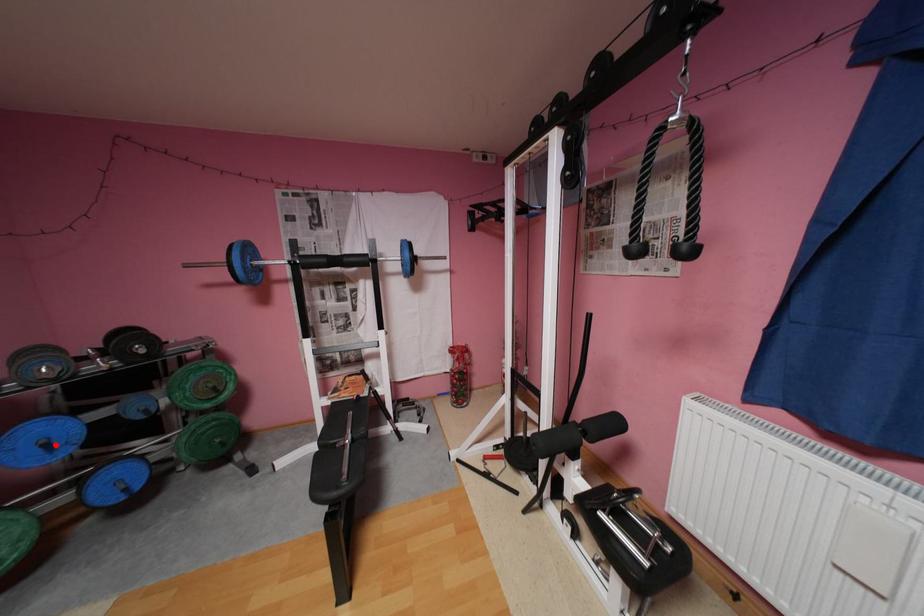
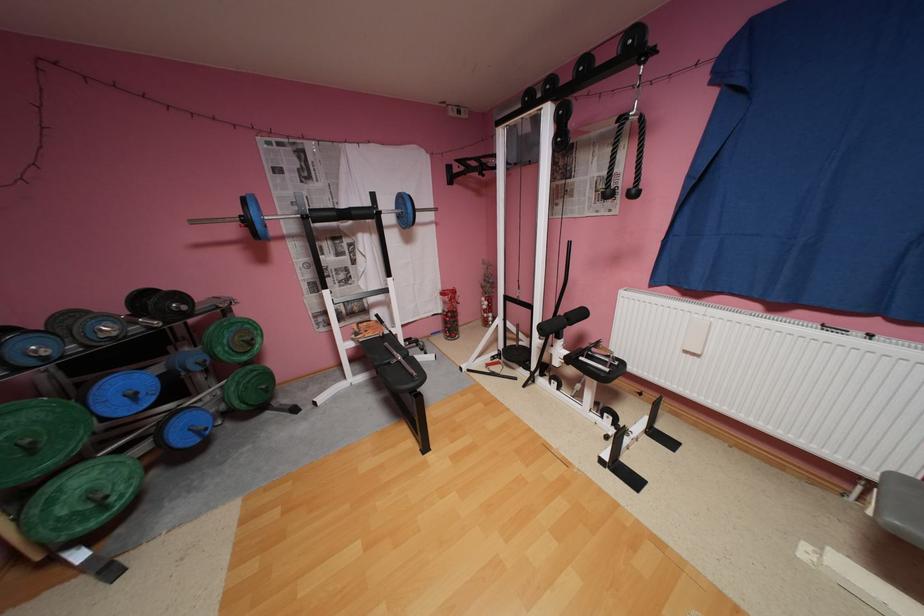
In the second image, find the point that corresponds to the highlighted location in the first image.

(142, 395)